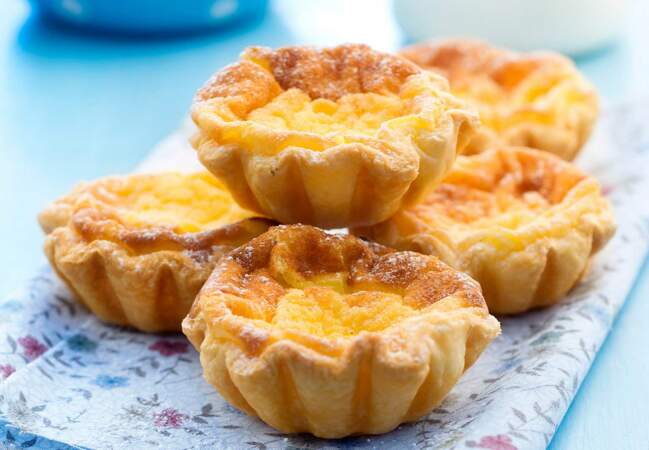
Find the location of a particular element. The width and height of the screenshot is (649, 450). napkin is located at coordinates (114, 369).